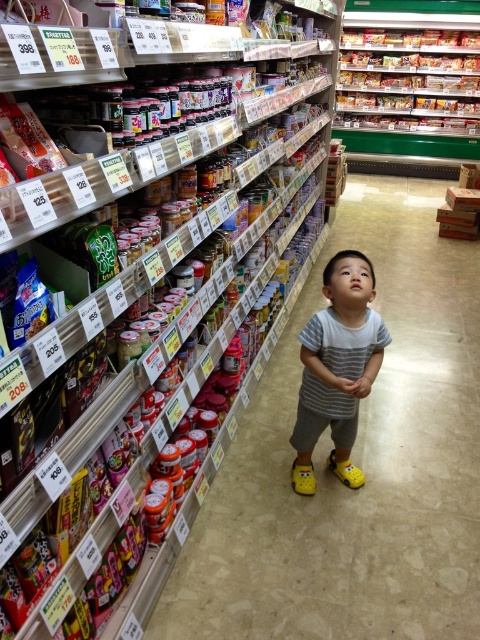
Between metallic silver snack at upper right and striped cotton shirt at center, which one is positioned higher?

Positioned higher is metallic silver snack at upper right.

Which is behind, point (384, 113) or point (335, 394)?

The point (384, 113) is behind.

Which is behind, point (363, 49) or point (348, 266)?

Positioned behind is point (363, 49).

This screenshot has width=480, height=640. Find the location of `metallic silver snack at upper right`. metallic silver snack at upper right is located at coordinates (409, 81).